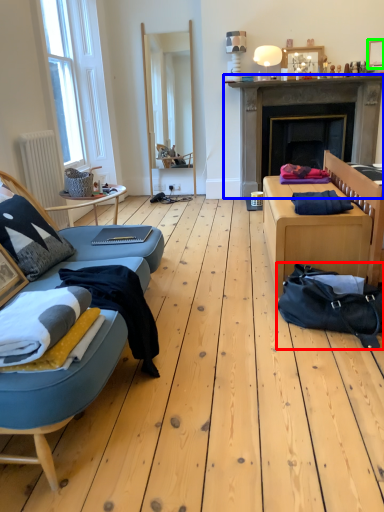
Question: Which object is positioned closest to bag (highlighted by a red box)? Select from fireplace (highlighted by a blue box) and picture frame (highlighted by a green box).

Choices:
 (A) fireplace
 (B) picture frame

Answer: (A)